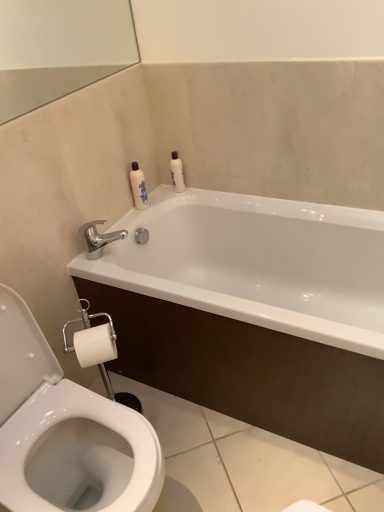
Question: Is there a large distance between white glossy bathtub at upper center and white glossy bottle at upper right, placed as the second toiletry when sorted from left to right?

Choices:
 (A) yes
 (B) no

Answer: (B)

Question: Is the depth of white glossy bathtub at upper center greater than that of white glossy bottle at upper right, arranged as the first toiletry when viewed from the right?

Choices:
 (A) yes
 (B) no

Answer: (B)

Question: From the image's perspective, is white glossy bathtub at upper center located above white glossy bottle at upper right, arranged as the first toiletry when viewed from the right?

Choices:
 (A) yes
 (B) no

Answer: (B)

Question: Can you confirm if white glossy bathtub at upper center is smaller than white glossy bottle at upper right, placed as the second toiletry when sorted from left to right?

Choices:
 (A) yes
 (B) no

Answer: (B)

Question: Does white glossy bathtub at upper center have a greater height compared to white glossy bottle at upper right, placed as the second toiletry when sorted from left to right?

Choices:
 (A) no
 (B) yes

Answer: (B)

Question: Does white glossy bathtub at upper center appear on the left side of white glossy bottle at upper right, placed as the second toiletry when sorted from left to right?

Choices:
 (A) yes
 (B) no

Answer: (B)

Question: Is white glossy bottle at upper center, the 1th toiletry positioned from the left, thinner than polished metallic faucet at upper left?

Choices:
 (A) yes
 (B) no

Answer: (A)

Question: From a real-world perspective, is white glossy bottle at upper center, the 1th toiletry positioned from the left, positioned under polished metallic faucet at upper left based on gravity?

Choices:
 (A) no
 (B) yes

Answer: (A)

Question: Is white glossy bottle at upper center, the 1th toiletry positioned from the left, placed right next to polished metallic faucet at upper left?

Choices:
 (A) yes
 (B) no

Answer: (B)

Question: Is the position of white glossy bottle at upper center, the 2th toiletry in the right-to-left sequence, less distant than that of polished metallic faucet at upper left?

Choices:
 (A) yes
 (B) no

Answer: (B)

Question: From a real-world perspective, is white glossy bottle at upper center, the 2th toiletry in the right-to-left sequence, located higher than polished metallic faucet at upper left?

Choices:
 (A) no
 (B) yes

Answer: (B)

Question: Would you say white glossy bottle at upper center, the 1th toiletry positioned from the left, is outside polished metallic faucet at upper left?

Choices:
 (A) no
 (B) yes

Answer: (B)

Question: Considering the relative sizes of white glossy bottle at upper center, the 2th toiletry in the right-to-left sequence, and white glossy bathtub at upper center in the image provided, is white glossy bottle at upper center, the 2th toiletry in the right-to-left sequence, taller than white glossy bathtub at upper center?

Choices:
 (A) yes
 (B) no

Answer: (B)